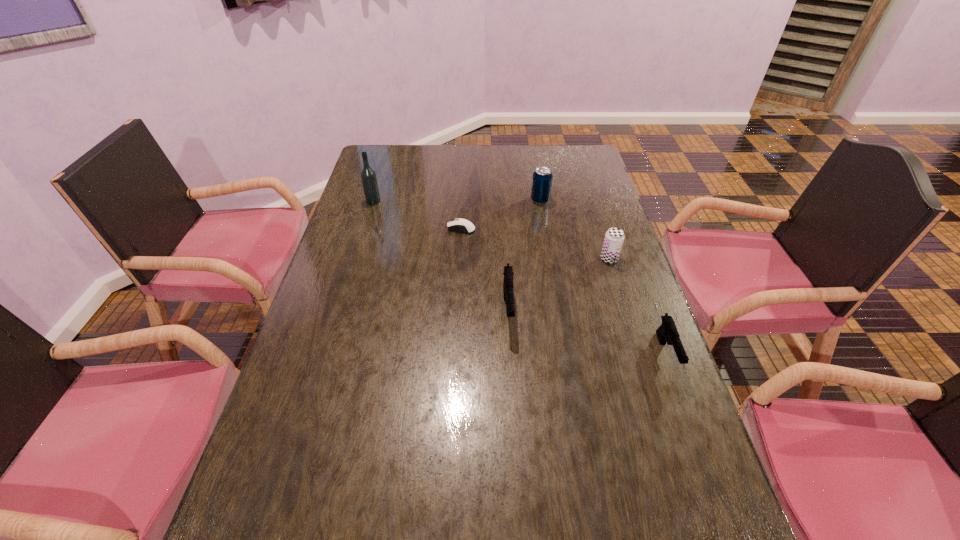
Locate an element on the screen. vacant place for an extra pistol on the left is located at coordinates (375, 273).